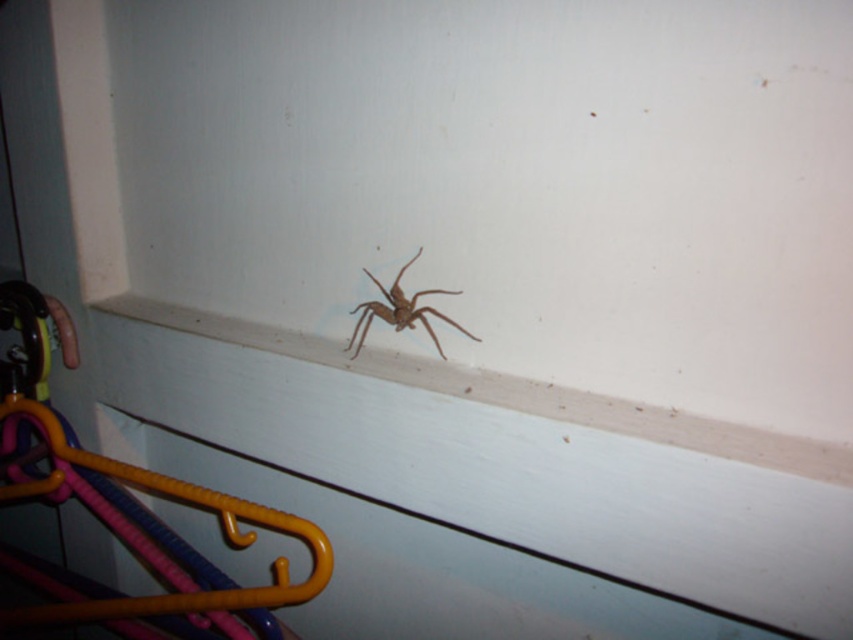
You are a housekeeper cleaning the window sill. You see the white smooth window sill at center and the brown fuzzy spider at center. Where is the spider located relative to the window sill?

The brown fuzzy spider at center is above the white smooth window sill at center.

You are a small toy car that is 10 cm tall. You are driving towards the orange plastic hanger at lower left and the brown fuzzy spider at center. Which object will block your path first?

The orange plastic hanger at lower left is in front of the brown fuzzy spider at center, so the orange plastic hanger at lower left will block your path first.